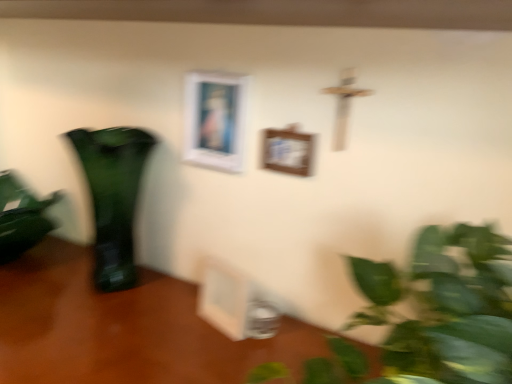
Question: Is white matte picture frame at upper center, which ranks as the 3th picture frame in bottom-to-top order, looking in the opposite direction of wooden table at lower left?

Choices:
 (A) yes
 (B) no

Answer: (B)

Question: Is white matte picture frame at upper center, which ranks as the 3th picture frame in bottom-to-top order, not within wooden table at lower left?

Choices:
 (A) yes
 (B) no

Answer: (A)

Question: Is white matte picture frame at upper center, which ranks as the 3th picture frame in bottom-to-top order, beside wooden table at lower left?

Choices:
 (A) yes
 (B) no

Answer: (B)

Question: Is white matte picture frame at upper center, which is the 1th picture frame from top to bottom, positioned behind wooden table at lower left?

Choices:
 (A) no
 (B) yes

Answer: (B)

Question: Is the position of white matte picture frame at upper center, which is the 1th picture frame from top to bottom, less distant than that of wooden table at lower left?

Choices:
 (A) no
 (B) yes

Answer: (A)

Question: In terms of size, does wooden picture frame at center, the third picture frame when ordered from top to bottom, appear bigger or smaller than green glass vase at left?

Choices:
 (A) big
 (B) small

Answer: (B)

Question: Considering the positions of wooden picture frame at center, acting as the first picture frame starting from the bottom, and green glass vase at left in the image, is wooden picture frame at center, acting as the first picture frame starting from the bottom, taller or shorter than green glass vase at left?

Choices:
 (A) tall
 (B) short

Answer: (B)

Question: Relative to green glass vase at left, is wooden picture frame at center, acting as the first picture frame starting from the bottom, in front or behind?

Choices:
 (A) front
 (B) behind

Answer: (A)

Question: In terms of width, does wooden picture frame at center, acting as the first picture frame starting from the bottom, look wider or thinner when compared to green glass vase at left?

Choices:
 (A) thin
 (B) wide

Answer: (A)

Question: Is green glass vase at left spatially inside white matte picture frame at upper center, which ranks as the 3th picture frame in bottom-to-top order, or outside of it?

Choices:
 (A) inside
 (B) outside

Answer: (B)

Question: Considering the positions of green glass vase at left and white matte picture frame at upper center, which is the 1th picture frame from top to bottom, in the image, is green glass vase at left taller or shorter than white matte picture frame at upper center, which is the 1th picture frame from top to bottom,?

Choices:
 (A) tall
 (B) short

Answer: (A)

Question: From a real-world perspective, is green glass vase at left positioned above or below white matte picture frame at upper center, which is the 1th picture frame from top to bottom?

Choices:
 (A) below
 (B) above

Answer: (A)

Question: Does point (100, 281) appear closer or farther from the camera than point (199, 165)?

Choices:
 (A) farther
 (B) closer

Answer: (B)

Question: Considering the relative positions of wooden picture frame at center, which ranks as the 2th picture frame in bottom-to-top order, and green glossy houseplant at left in the image provided, is wooden picture frame at center, which ranks as the 2th picture frame in bottom-to-top order, to the left or to the right of green glossy houseplant at left?

Choices:
 (A) left
 (B) right

Answer: (B)

Question: Based on their sizes in the image, would you say wooden picture frame at center, marked as the second picture frame in a top-to-bottom arrangement, is bigger or smaller than green glossy houseplant at left?

Choices:
 (A) big
 (B) small

Answer: (B)